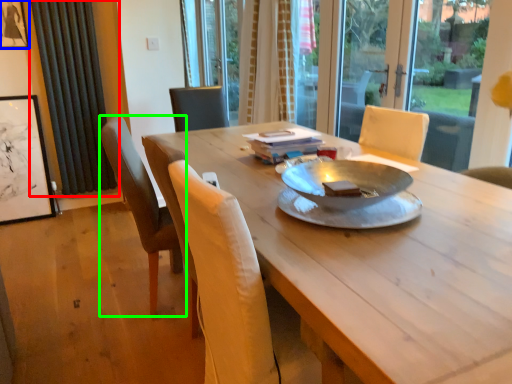
Question: Considering the real-world distances, which object is closest to curtain (highlighted by a red box)? picture frame (highlighted by a blue box) or chair (highlighted by a green box).

Choices:
 (A) picture frame
 (B) chair

Answer: (A)